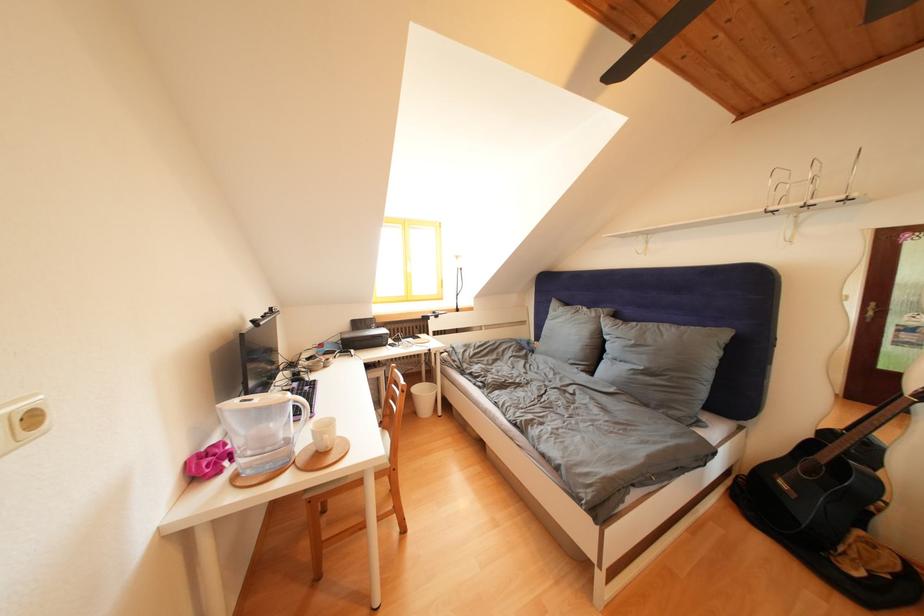
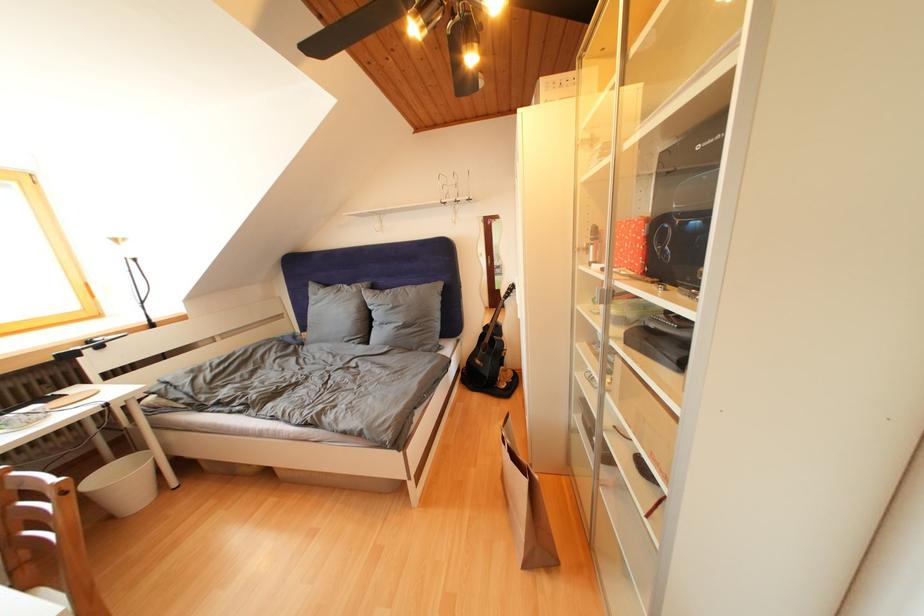
Question: The first image is from the beginning of the video and the second image is from the end. How did the camera likely rotate when shooting the video?

Choices:
 (A) Left
 (B) Right
 (C) Up
 (D) Down

Answer: (B)